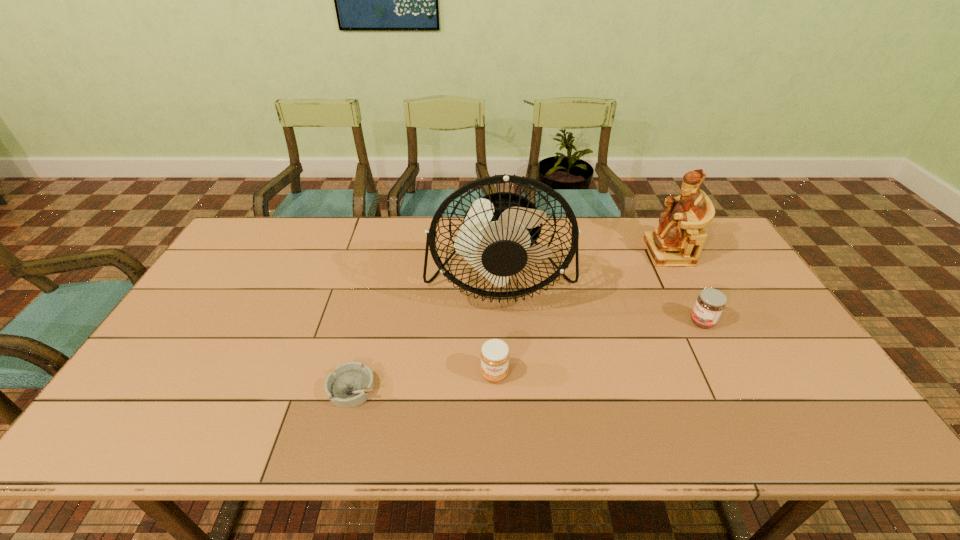
At what (x,y) coordinates should I click in order to perform the action: click on the tallest object. Please return your answer as a coordinate pair (x, y). The width and height of the screenshot is (960, 540). Looking at the image, I should click on (497, 237).

Identify the location of figurine. Image resolution: width=960 pixels, height=540 pixels. (678, 241).

Image resolution: width=960 pixels, height=540 pixels. I want to click on the farther jam, so click(x=710, y=303).

The width and height of the screenshot is (960, 540). Find the location of `the nearer jam`. the nearer jam is located at coordinates (495, 355).

I want to click on the leftmost object, so click(x=351, y=384).

Identify the location of ashtray. (351, 384).

Identify the location of vacant space situated 0.150m in front of the fan, directing airflow. (504, 363).

Where is `vacant point located on the front-facing side of the fourth shortest object`? vacant point located on the front-facing side of the fourth shortest object is located at coordinates (569, 253).

What are the coordinates of `free space located 0.220m on the front-facing side of the fourth shortest object` in the screenshot? It's located at (582, 253).

Where is `free space located on the front-facing side of the fourth shortest object`? This screenshot has height=540, width=960. free space located on the front-facing side of the fourth shortest object is located at coordinates (624, 253).